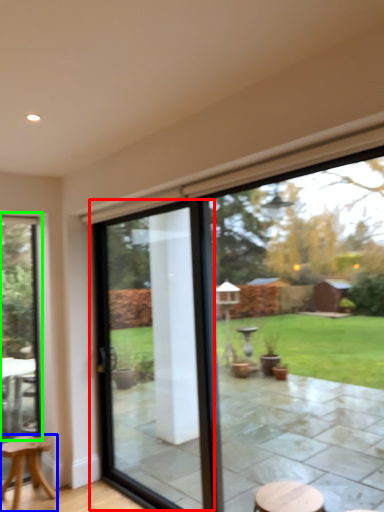
Question: Which object is the farthest from screen door (highlighted by a red box)? Choose among these: stool (highlighted by a blue box) or window (highlighted by a green box).

Choices:
 (A) stool
 (B) window

Answer: (A)